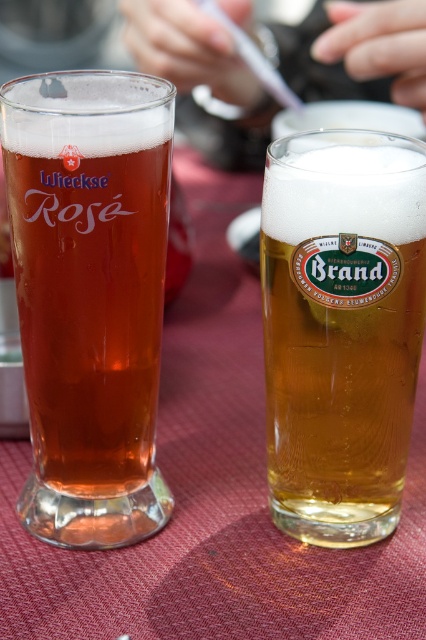
Question: Which of the following is the farthest from the observer?

Choices:
 (A) (146, 392)
 (B) (271, 196)

Answer: (A)

Question: Does matte glass at left lie behind golden glass beer at center?

Choices:
 (A) no
 (B) yes

Answer: (A)

Question: Does matte glass at left have a greater width compared to golden glass beer at center?

Choices:
 (A) no
 (B) yes

Answer: (B)

Question: Does matte glass at left have a lesser width compared to golden glass beer at center?

Choices:
 (A) yes
 (B) no

Answer: (B)

Question: Which point is closer to the camera taking this photo?

Choices:
 (A) (313, 305)
 (B) (152, 198)

Answer: (B)

Question: Which point is closer to the camera?

Choices:
 (A) (40, 358)
 (B) (279, 387)

Answer: (A)